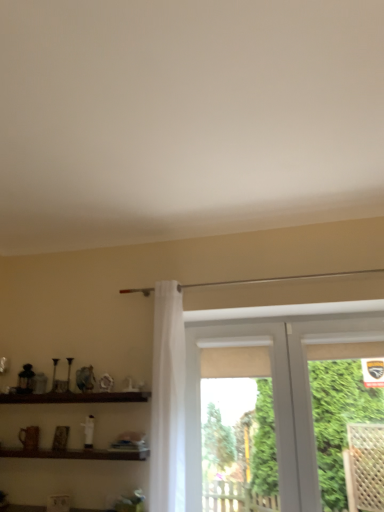
Question: Is brown wooden shelf at lower left, the second shelf from the top, to the left or to the right of brown wooden shelf at lower left, positioned as the second shelf in bottom-to-top order, in the image?

Choices:
 (A) right
 (B) left

Answer: (A)

Question: From a real-world perspective, relative to brown wooden shelf at lower left, placed as the first shelf when sorted from top to bottom, is brown wooden shelf at lower left, positioned as the 1th shelf in bottom-to-top order, vertically above or below?

Choices:
 (A) below
 (B) above

Answer: (A)

Question: Considering the real-world distances, which object is farthest from the brown wooden shelf at lower left, positioned as the second shelf in bottom-to-top order?

Choices:
 (A) green leafy plant at right
 (B) brown wooden shelf at lower left, the second shelf from the top
 (C) white plastic window at center

Answer: (A)

Question: Based on their relative distances, which object is nearer to the white plastic window at center?

Choices:
 (A) brown wooden shelf at lower left, placed as the first shelf when sorted from top to bottom
 (B) brown wooden shelf at lower left, the second shelf from the top
 (C) green leafy plant at right

Answer: (C)